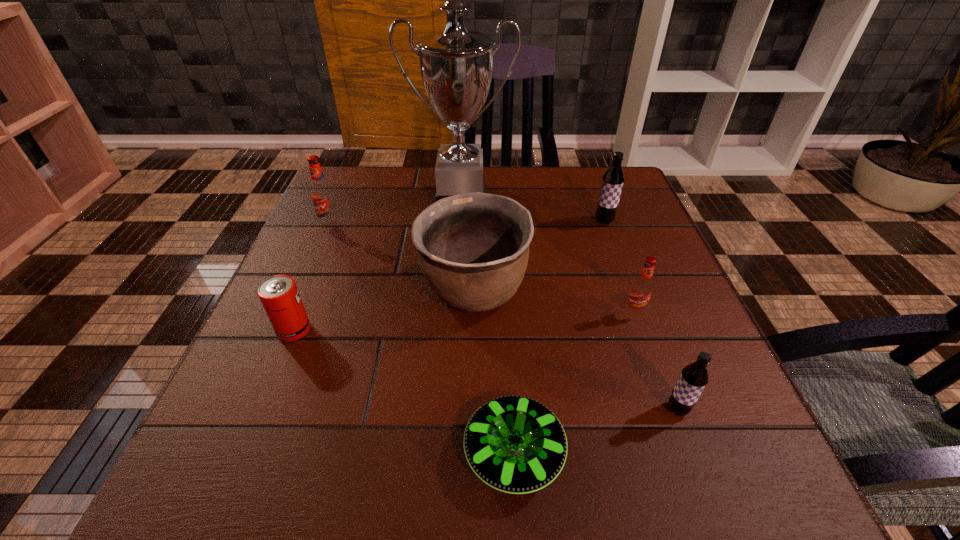
Where is `root beer that is the nearest to the right red root beer`? Image resolution: width=960 pixels, height=540 pixels. root beer that is the nearest to the right red root beer is located at coordinates (694, 377).

Locate an element on the screen. Image resolution: width=960 pixels, height=540 pixels. vacant space that satisfies the following two spatial constraints: 1. on the front side of the second nearest root beer; 2. on the left side of the pottery is located at coordinates (472, 312).

Where is `free region that satisfies the following two spatial constraints: 1. at the front view of the tallest object; 2. on the right side of the bigger brown root beer`? Image resolution: width=960 pixels, height=540 pixels. free region that satisfies the following two spatial constraints: 1. at the front view of the tallest object; 2. on the right side of the bigger brown root beer is located at coordinates (459, 221).

Where is `free location that satisfies the following two spatial constraints: 1. on the front side of the pottery; 2. on the right side of the smaller red root beer`? The height and width of the screenshot is (540, 960). free location that satisfies the following two spatial constraints: 1. on the front side of the pottery; 2. on the right side of the smaller red root beer is located at coordinates (472, 312).

Where is `vacant space that satisfies the following two spatial constraints: 1. on the back side of the bigger brown root beer; 2. on the left side of the bigger red root beer`? vacant space that satisfies the following two spatial constraints: 1. on the back side of the bigger brown root beer; 2. on the left side of the bigger red root beer is located at coordinates point(332,221).